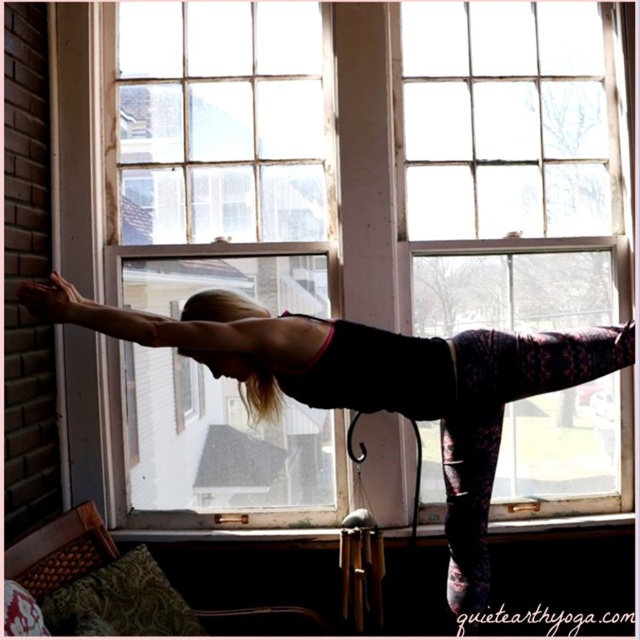
You are a photographer wanting to capture the reflection of the clear glass window at center in the black matte yoga pants at center. Is the window large enough to be fully reflected in the pants?

The clear glass window at center is smaller than the black matte yoga pants at center, so the window can be fully reflected in the pants since it is smaller in size.

You are a photographer trying to capture the clear glass window at center and the black matte yoga pants at center in a single shot. Since you want to ensure both are in focus, which object should you prioritize focusing on first?

You should prioritize focusing on the clear glass window at center first because it is closer to the viewer than the black matte yoga pants at center, ensuring both will be in focus if you focus on the closer object.